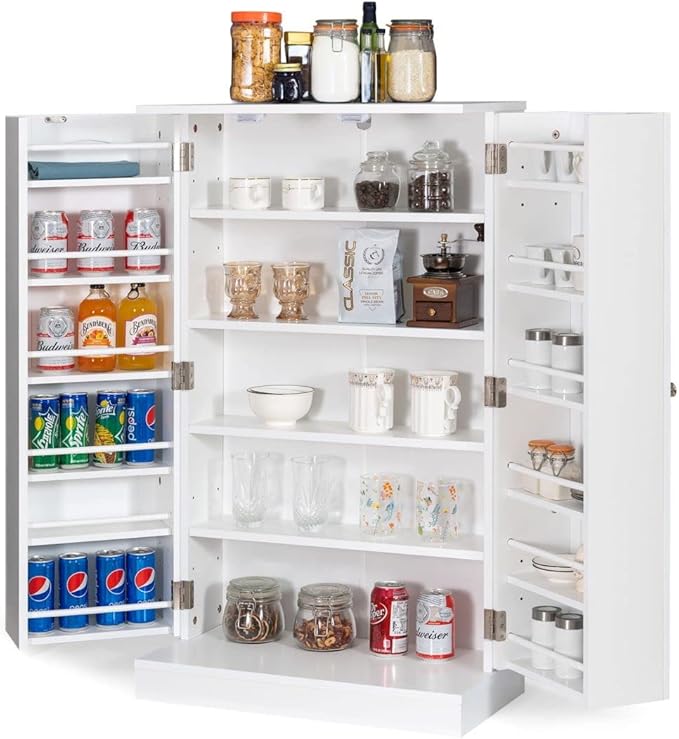
Locate an element on the screen. The height and width of the screenshot is (739, 679). items on top of cabinet is located at coordinates 242,29, 292,33, 335,61, 365,67, 379,40, 366,12, 286,80, 414,67.